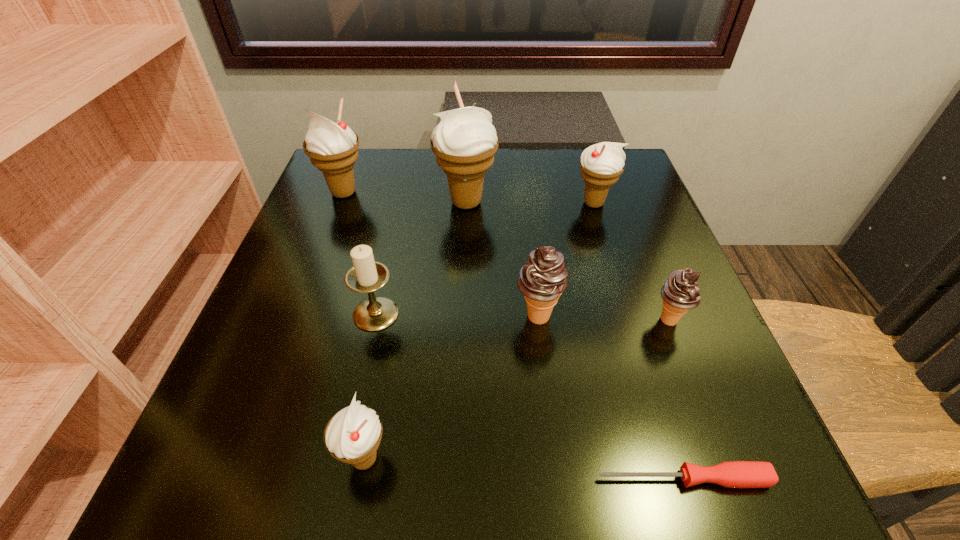
Locate an element on the screen. This screenshot has width=960, height=540. the fourth object from left to right is located at coordinates [x=465, y=141].

Where is `the second white icecream from right to left`? The image size is (960, 540). the second white icecream from right to left is located at coordinates (465, 141).

Where is `the leftmost white icecream`? This screenshot has height=540, width=960. the leftmost white icecream is located at coordinates (332, 147).

Locate an element on the screen. the leftmost icecream is located at coordinates (332, 147).

What are the coordinates of `the second smallest white icecream` in the screenshot? It's located at [601, 164].

At what (x,y) coordinates should I click in order to perform the action: click on the bigger chocolate icecream. Please return your answer as a coordinate pair (x, y). Looking at the image, I should click on (542, 279).

This screenshot has width=960, height=540. In order to click on the fifth object from left to right in this screenshot , I will do `click(542, 279)`.

Locate an element on the screen. The image size is (960, 540). white candle holder is located at coordinates (375, 313).

The height and width of the screenshot is (540, 960). Find the location of `the smaller chocolate icecream`. the smaller chocolate icecream is located at coordinates coord(681,292).

At what (x,y) coordinates should I click in order to perform the action: click on the second white icecream from left to right. Please return your answer as a coordinate pair (x, y). The image size is (960, 540). Looking at the image, I should click on (352, 435).